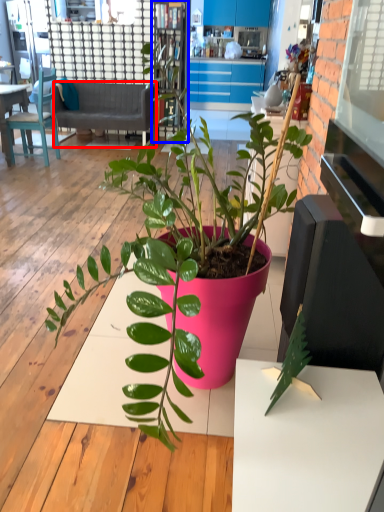
Question: Which object appears farthest to the camera in this image, studio couch (highlighted by a red box) or bookshelf (highlighted by a blue box)?

Choices:
 (A) studio couch
 (B) bookshelf

Answer: (A)